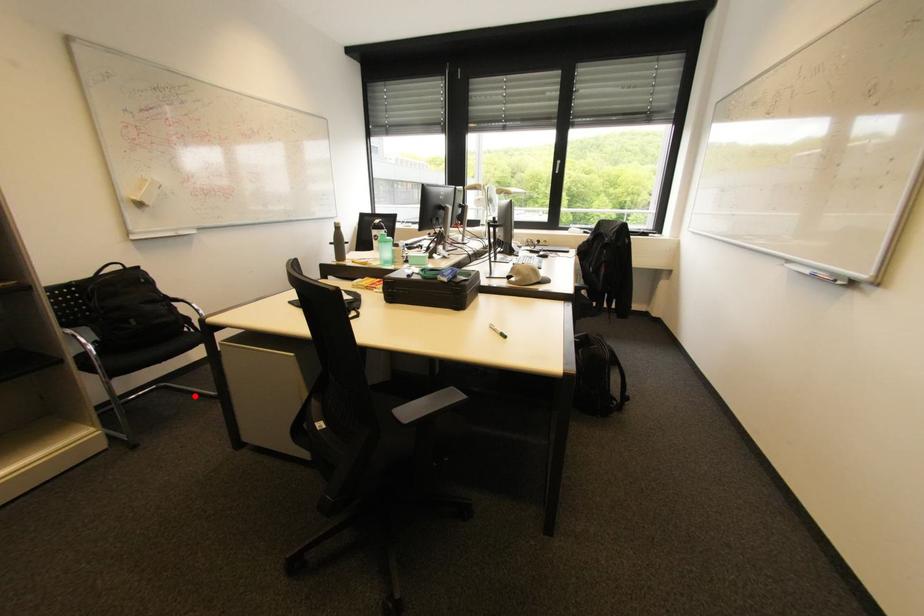
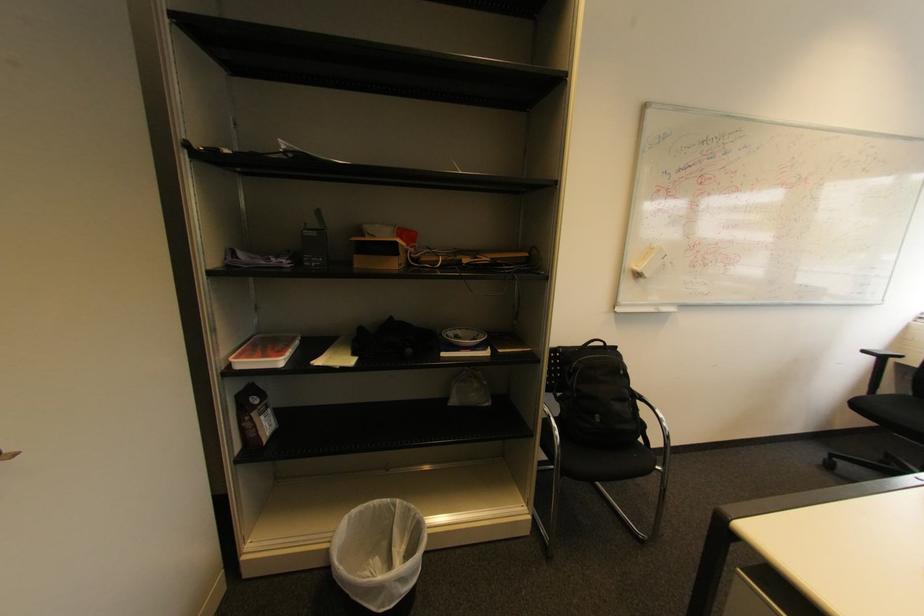
Locate, in the second image, the point that corresponds to the highlighted location in the first image.

(611, 506)